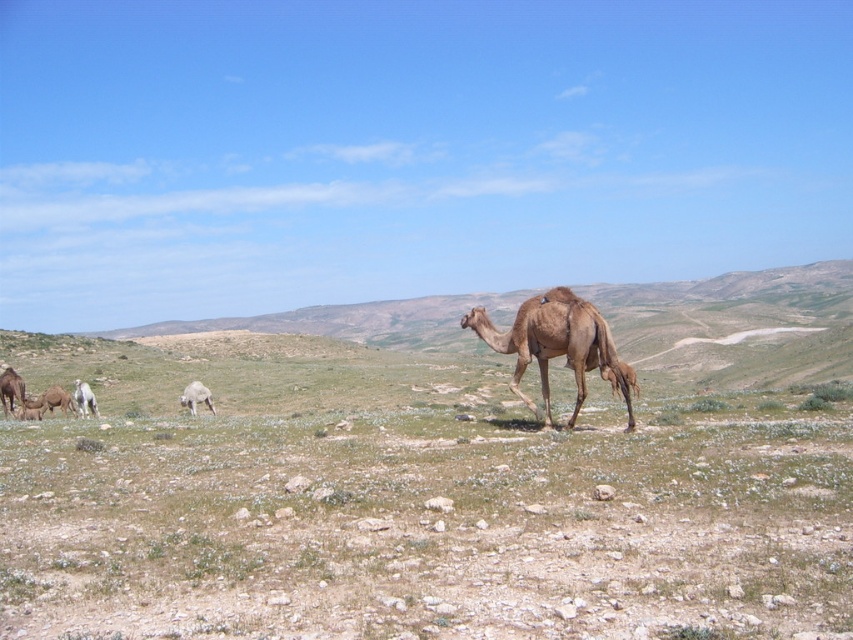
Which is more to the left, white woolly sheep at lower left or light brown camel at lower left?

light brown camel at lower left is more to the left.

Where is `white woolly sheep at lower left`? white woolly sheep at lower left is located at coordinates (196, 396).

Which is behind, point (193, 410) or point (73, 397)?

The point (73, 397) is behind.

This screenshot has width=853, height=640. In order to click on white woolly sheep at lower left in this screenshot , I will do `click(196, 396)`.

Does brown matte camel at center appear under white woolly sheep at lower left?

Actually, brown matte camel at center is above white woolly sheep at lower left.

Locate an element on the screen. This screenshot has width=853, height=640. brown matte camel at center is located at coordinates (556, 346).

Which of these two, brown matte camel at center or light brown camel at lower left, stands shorter?

brown matte camel at center

Does point (469, 326) come behind point (91, 404)?

No, it is not.

Is point (631, 376) positioned behind point (93, 403)?

That is False.

Find the location of a particular element. The image size is (853, 640). brown matte camel at center is located at coordinates (556, 346).